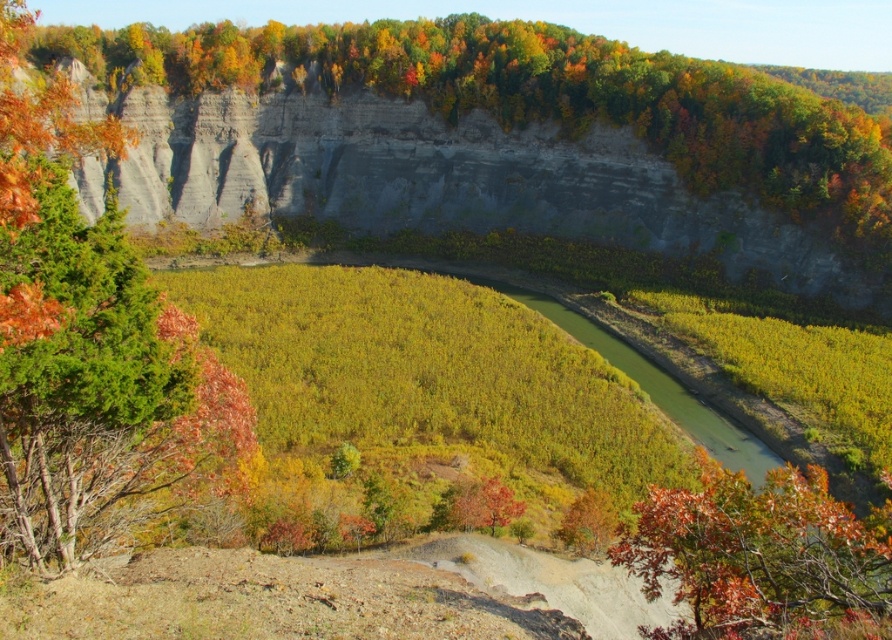
You are standing at the point labeled as point [546,97] in the image. Looking around, you see a smooth gray cliff face at upper center. What is the immediate terrain feature directly beneath your feet?

The point [546,97] indicates a smooth gray cliff face at upper center, so the immediate terrain feature directly beneath your feet is the smooth gray cliff face at upper center.

You are an artist planning to paint the scene. You want to emphasize the contrast between the green leafy tree at left and the smooth gray cliff face at upper center. Which object should you make thicker in your painting to highlight their difference?

To highlight the contrast between the green leafy tree at left and the smooth gray cliff face at upper center, you should make the smooth gray cliff face at upper center thicker in your painting since the cliff face is naturally thicker than the tree according to the description.

Looking at this image, you are an explorer trying to cross the river. You have two options to cross it. One is to climb the smooth gray cliff face at upper center, and the other is to walk through the autumn leaves at lower right. Which path is wider for you to pass through?

The smooth gray cliff face at upper center might be wider than autumn leaves at lower right, so the cliff face could be a better option for crossing due to its wider passage.